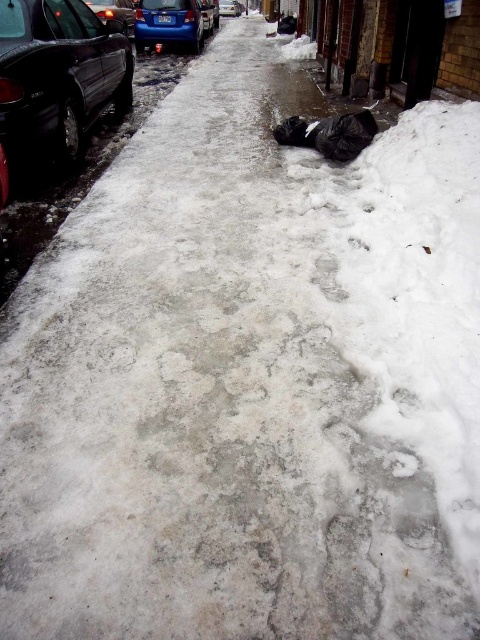
Looking at this image, you are standing at point A and want to walk to point B. The coordinates of point A are point A at (10, 77). The coordinates of point B are point B at 0.345, 0.678. The distance between them is 3.43 meters. Can you safely walk this distance without encountering any obstacles?

The distance between point A at (10, 77) and point B at 0.345, 0.678 is 3.43 meters. However, the scene description mentions a black trash bag lying near the building on the right side and slushy areas with patches of ice. These obstacles could pose a risk, so you should proceed with caution to avoid slipping or tripping over the trash bag.

You are standing at the point labeled point (240,10) and want to walk to the point labeled point (12,70). Given the snowy and icy conditions, which direction should you head to reach your destination?

Since point (12,70) is closer to the viewer than point (240,10), you should walk towards the direction of the parked cars on the left side of the image to reach your destination safely.

From the picture: You are a delivery person trying to park your van between the shiny blue sedan at upper left and the shiny metallic car at upper left. Based on the scene, can your van fit in the space between them?

The shiny blue sedan at upper left is wider than the shiny metallic car at upper left. However, without knowing the exact distance between them or the van size, it is impossible to determine if the van can fit.